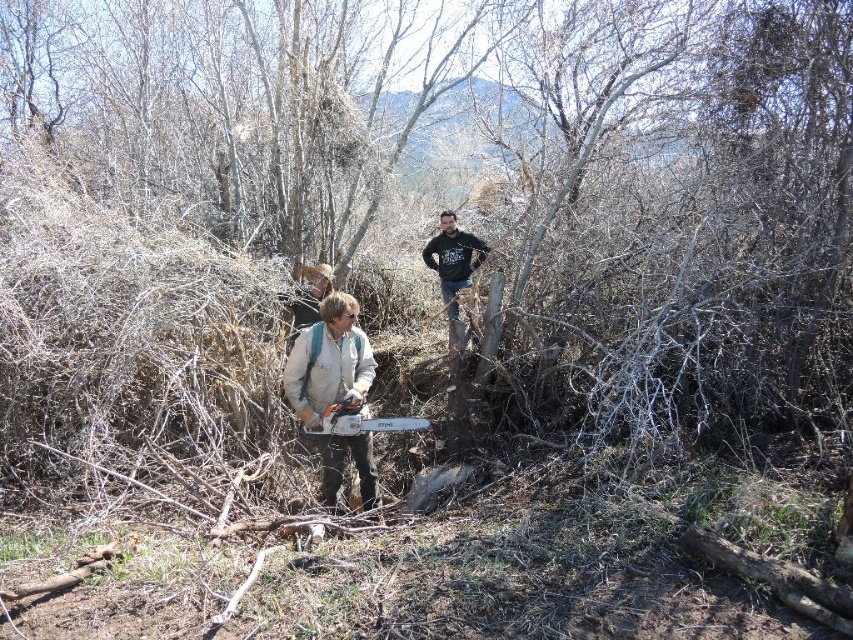
Question: Which point is closer to the camera?

Choices:
 (A) metallic gray chainsaw at center
 (B) light brown leather jacket at center
 (C) black cotton sweatshirt at upper center

Answer: (A)

Question: Considering the real-world distances, which object is farthest from the light brown leather jacket at center?

Choices:
 (A) black cotton sweatshirt at upper center
 (B) metallic gray chainsaw at center

Answer: (A)

Question: Does black cotton sweatshirt at upper center appear under metallic gray chainsaw at center?

Choices:
 (A) no
 (B) yes

Answer: (A)

Question: Which point is closer to the camera?

Choices:
 (A) (387, 432)
 (B) (364, 474)
 (C) (451, 225)

Answer: (A)

Question: Considering the relative positions of light brown leather jacket at center and metallic gray chainsaw at center in the image provided, where is light brown leather jacket at center located with respect to metallic gray chainsaw at center?

Choices:
 (A) below
 (B) above

Answer: (B)

Question: Observing the image, what is the correct spatial positioning of light brown leather jacket at center in reference to metallic gray chainsaw at center?

Choices:
 (A) above
 (B) below

Answer: (A)